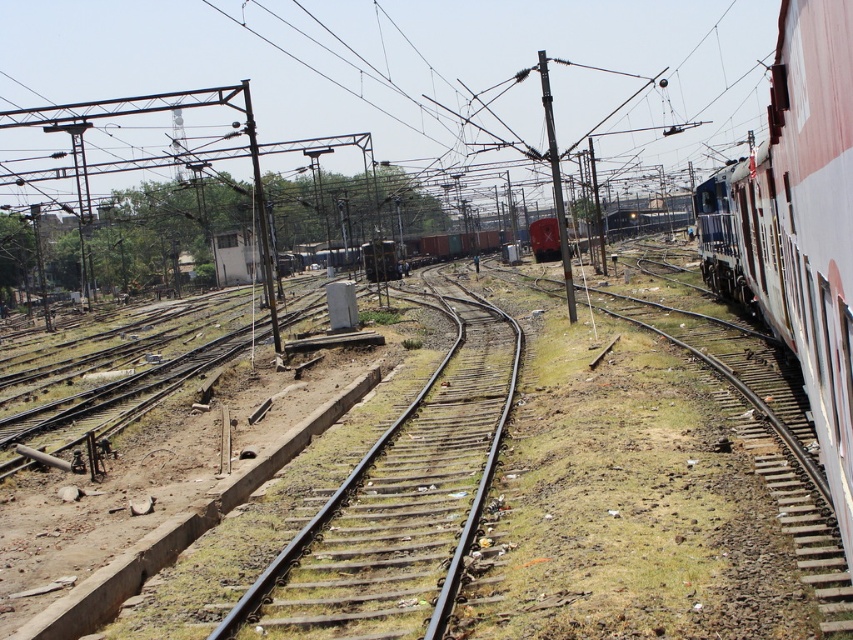
Is smooth metal train track at center closer to camera compared to white glossy train at right?

No.

Does smooth metal train track at center have a lesser height compared to white glossy train at right?

Yes, smooth metal train track at center is shorter than white glossy train at right.

Is point (259, 595) farther from camera compared to point (775, 141)?

No, (259, 595) is in front of (775, 141).

Image resolution: width=853 pixels, height=640 pixels. I want to click on smooth metal train track at center, so click(x=399, y=504).